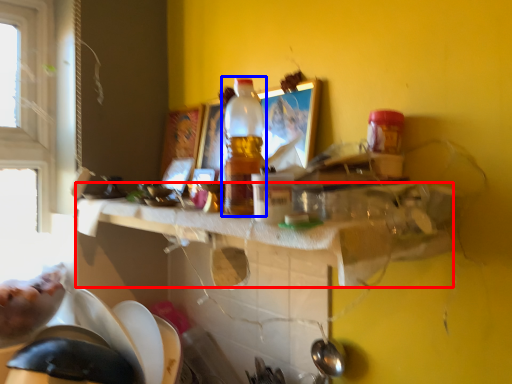
Question: Among these objects, which one is nearest to the camera, counter top (highlighted by a red box) or bottle (highlighted by a blue box)?

Choices:
 (A) counter top
 (B) bottle

Answer: (A)